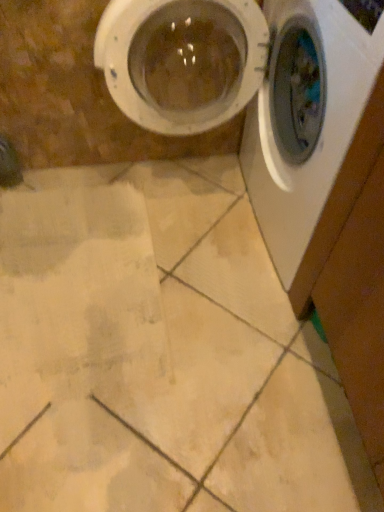
The image size is (384, 512). What are the coordinates of `free space in front of white plastic washing machine at upper right, which ranks as the first washing machine in left-to-right order` in the screenshot? It's located at (178, 384).